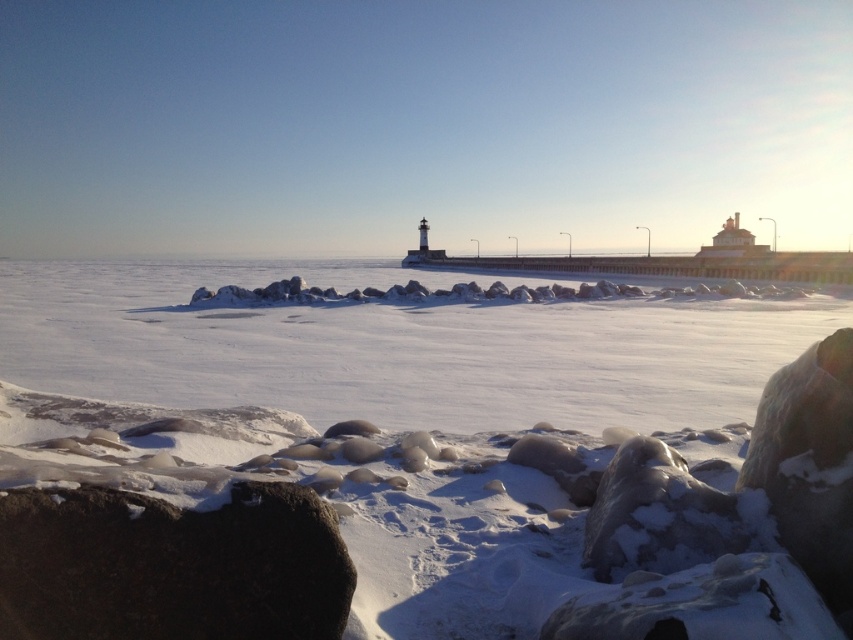
You are standing at the edge of the snowy landscape in the coastal winter scene. You see a point marked at coordinates (442,445). What is located at that point?

The point at coordinates (442,445) indicates white matte snow at center.

You are standing at the camera position and want to pick up the dark gray rock at lower left. Can you reach it without moving your feet?

The dark gray rock at lower left and camera are 3.05 meters apart, so you cannot reach it without moving your feet since the distance is too far.

You are standing at the edge of the snowy landscape and want to walk towards the dark gray rock at lower left. Is the white matte snow at center between you and the rock?

The white matte snow at center is further to the viewer than the dark gray rock at lower left, so yes, the white matte snow at center is between you and the dark gray rock at lower left.